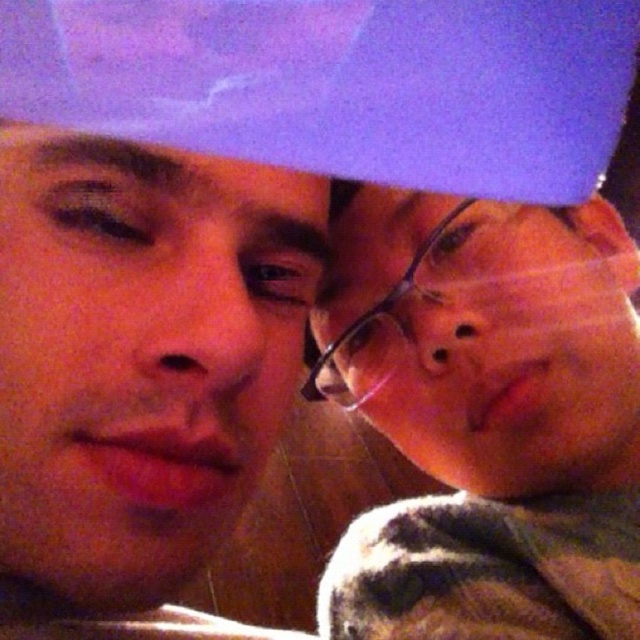
Based on the photo, is matte black glasses at right above smooth skin face at center?

Incorrect, matte black glasses at right is not positioned above smooth skin face at center.

Is point (340, 620) positioned in front of point (138, 493)?

No, (340, 620) is behind (138, 493).

The height and width of the screenshot is (640, 640). What are the coordinates of `matte black glasses at right` in the screenshot? It's located at (486, 417).